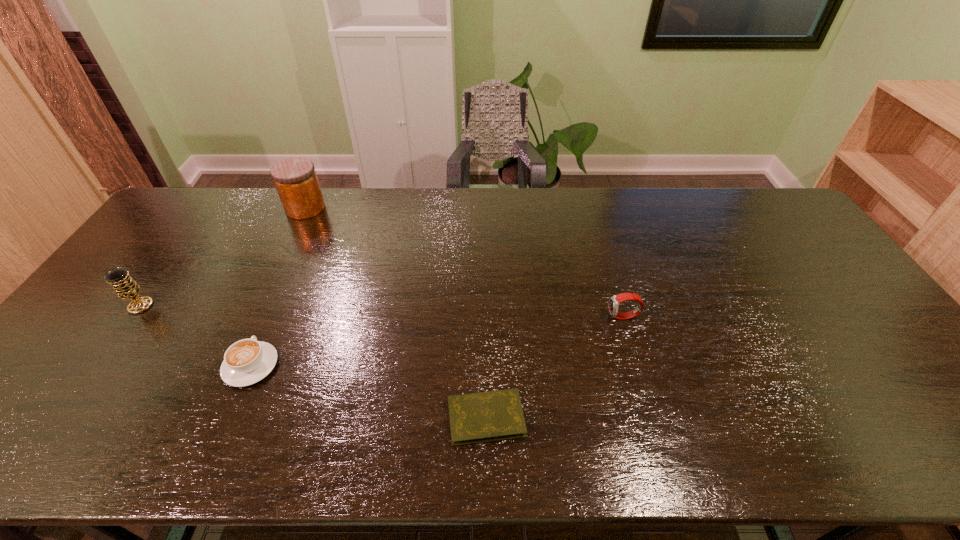
At what (x,y) coordinates should I click in order to perform the action: click on free space that satisfies the following two spatial constraints: 1. on the face of the watch; 2. on the front side of the shortest object. Please return your answer as a coordinate pair (x, y). Looking at the image, I should click on (654, 417).